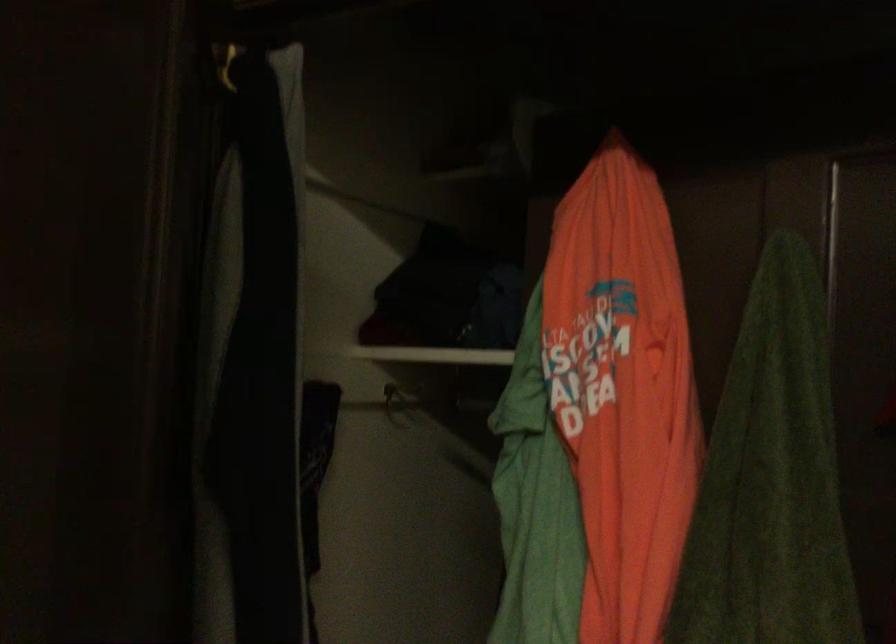
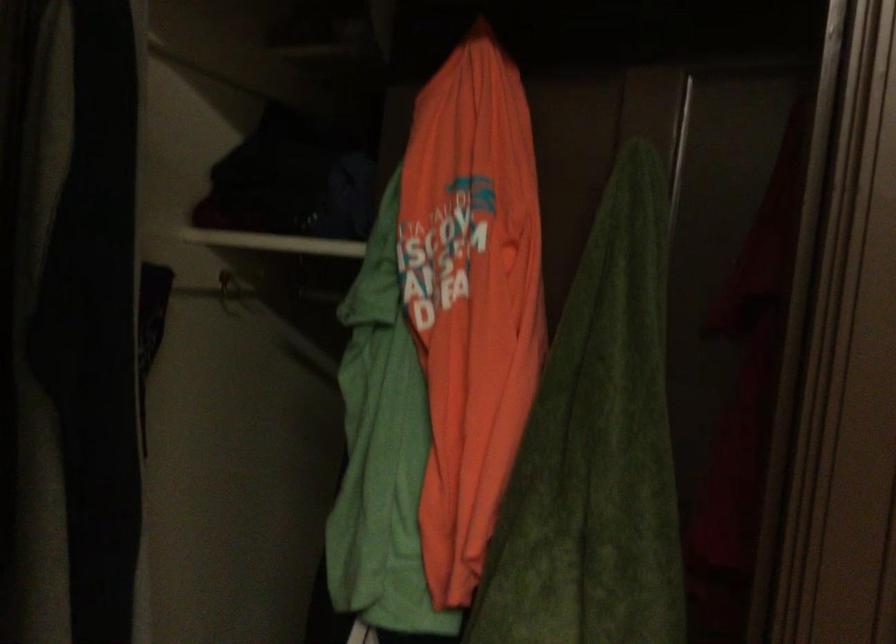
The images are taken continuously from a first-person perspective. In which direction are you moving?

The cameraman moved toward left, forward.